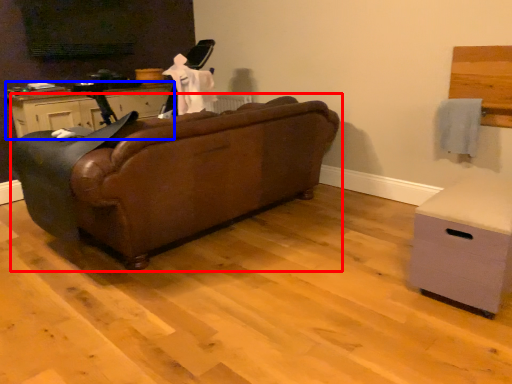
Question: Which object is further to the camera taking this photo, studio couch (highlighted by a red box) or cabinetry (highlighted by a blue box)?

Choices:
 (A) studio couch
 (B) cabinetry

Answer: (B)